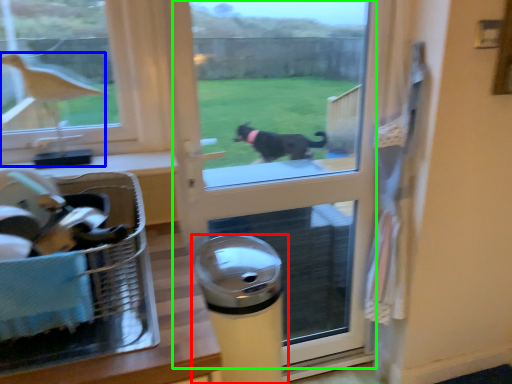
Question: Which object is positioned closest to waste container (highlighted by a red box)? Select from bird (highlighted by a blue box) and screen door (highlighted by a green box).

Choices:
 (A) bird
 (B) screen door

Answer: (A)